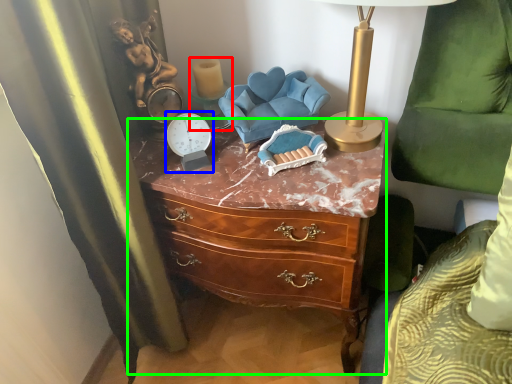
Question: Estimate the real-world distances between objects in this image. Which object is farther from candle holder (highlighted by a red box), clock (highlighted by a blue box) or chest of drawers (highlighted by a green box)?

Choices:
 (A) clock
 (B) chest of drawers

Answer: (B)